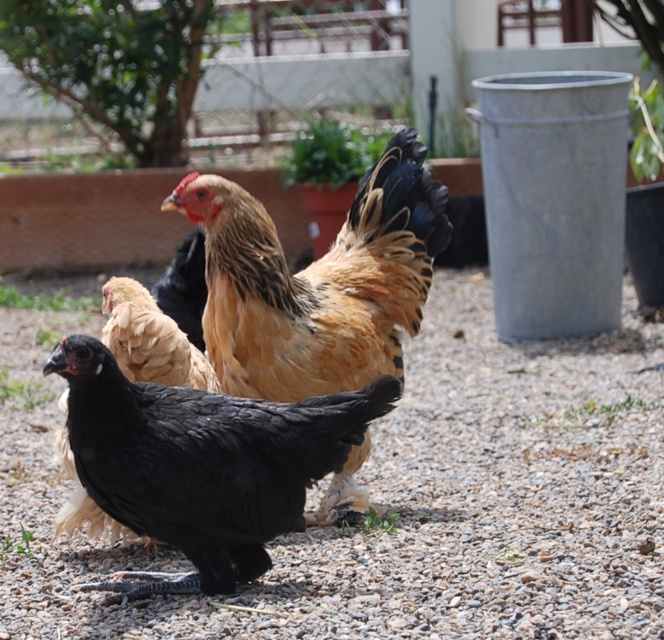
You are standing in the backyard and want to walk from the black matte chicken at lower left to the gray gravel at center. Which direction should you move relative to the chicken?

To move from the black matte chicken at lower left to the gray gravel at center, you should move to the right since the gray gravel at center is positioned on the right side of the black matte chicken at lower left.